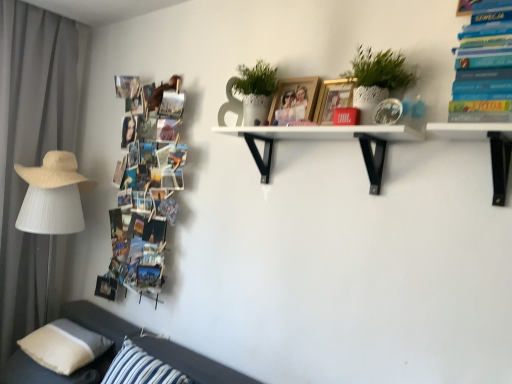
What do you see at coordinates (326, 139) in the screenshot? Image resolution: width=512 pixels, height=384 pixels. I see `white matte shelf at center` at bounding box center [326, 139].

The height and width of the screenshot is (384, 512). What are the coordinates of `wooden photo collage at left, the 1th book in the back-to-front sequence` in the screenshot? It's located at (145, 192).

Find the location of `white matte shelf at center`. white matte shelf at center is located at coordinates (326, 139).

Does white matte shelf at center have a lesser height compared to hardcover book at upper right, arranged as the 2th book when viewed from the left?

Correct, white matte shelf at center is not as tall as hardcover book at upper right, arranged as the 2th book when viewed from the left.

Which of these two, white matte shelf at center or hardcover book at upper right, the first book positioned from the right, is wider?

Wider between the two is white matte shelf at center.

From a real-world perspective, which is physically below, white matte shelf at center or hardcover book at upper right, the 1th book viewed from the front?

From a 3D spatial view, white matte shelf at center is below.

Would you consider white matte shelf at center to be distant from hardcover book at upper right, the first book positioned from the right?

No.

Identify the location of book that is the 1st object located in front of the gray fabric curtain at left. Image resolution: width=512 pixels, height=384 pixels. (145, 192).

Is gray fabric curtain at left located outside wooden photo collage at left, the 2th book in the right-to-left sequence?

Yes, gray fabric curtain at left is not within wooden photo collage at left, the 2th book in the right-to-left sequence.

Considering the relative sizes of gray fabric curtain at left and wooden photo collage at left, which is the second book from front to back, in the image provided, is gray fabric curtain at left shorter than wooden photo collage at left, which is the second book from front to back,?

In fact, gray fabric curtain at left may be taller than wooden photo collage at left, which is the second book from front to back.

Measure the distance between gray fabric curtain at left and wooden photo collage at left, which is the second book from front to back.

gray fabric curtain at left and wooden photo collage at left, which is the second book from front to back, are 27.02 inches apart from each other.

Consider the image. From a real-world perspective, who is located higher, white matte shelf at center or dark gray fabric couch at lower left?

white matte shelf at center, from a real-world perspective.

Looking at this image, is white matte shelf at center facing away from dark gray fabric couch at lower left?

white matte shelf at center is not turned away from dark gray fabric couch at lower left.

Is there a large distance between white matte shelf at center and dark gray fabric couch at lower left?

That's right, there is a large distance between white matte shelf at center and dark gray fabric couch at lower left.

Is metallic gold picture frame at upper center, the 1th picture frame when ordered from front to back, turned away from beige fabric pillow at lower left, which ranks as the 1th pillow in left-to-right order?

metallic gold picture frame at upper center, the 1th picture frame when ordered from front to back, does not have its back to beige fabric pillow at lower left, which ranks as the 1th pillow in left-to-right order.

Can you confirm if metallic gold picture frame at upper center, the 1th picture frame when ordered from front to back, is positioned to the right of beige fabric pillow at lower left, which ranks as the 1th pillow in left-to-right order?

Yes.

Who is shorter, metallic gold picture frame at upper center, placed as the second picture frame when sorted from back to front, or beige fabric pillow at lower left, which ranks as the 1th pillow in left-to-right order?

beige fabric pillow at lower left, which ranks as the 1th pillow in left-to-right order, is shorter.

Is point (352, 86) farther from camera compared to point (88, 355)?

No, (352, 86) is closer to viewer.

Consider the image. Between hardcover book at upper right, placed as the 2th book when sorted from back to front, and white textured pot at upper center, which one has more height?

With more height is hardcover book at upper right, placed as the 2th book when sorted from back to front.

Is hardcover book at upper right, placed as the 2th book when sorted from back to front, to the right of white textured pot at upper center from the viewer's perspective?

Yes, hardcover book at upper right, placed as the 2th book when sorted from back to front, is to the right of white textured pot at upper center.

Which of these two, hardcover book at upper right, placed as the 2th book when sorted from back to front, or white textured pot at upper center, is bigger?

With larger size is white textured pot at upper center.

Is beige fabric pillow at lower left, which is the 2th pillow from right to left, situated inside wooden photo collage at left, which is the first book from left to right, or outside?

beige fabric pillow at lower left, which is the 2th pillow from right to left, cannot be found inside wooden photo collage at left, which is the first book from left to right.

Which pillow is the 1st one when counting from the front of the wooden photo collage at left, the 2th book in the right-to-left sequence? Please provide its 2D coordinates.

[(64, 346)]

Can you confirm if beige fabric pillow at lower left, which ranks as the 1th pillow in left-to-right order, is bigger than wooden photo collage at left, the 2th book in the right-to-left sequence?

Incorrect, beige fabric pillow at lower left, which ranks as the 1th pillow in left-to-right order, is not larger than wooden photo collage at left, the 2th book in the right-to-left sequence.

Can you confirm if striped fabric pillow at lower left, which ranks as the first pillow in right-to-left order, is wider than metallic gold picture frame at upper center, placed as the second picture frame when sorted from back to front?

Indeed, striped fabric pillow at lower left, which ranks as the first pillow in right-to-left order, has a greater width compared to metallic gold picture frame at upper center, placed as the second picture frame when sorted from back to front.

Is point (161, 368) behind point (319, 115)?

Yes, point (161, 368) is farther from viewer.

Does striped fabric pillow at lower left, which ranks as the first pillow in right-to-left order, touch metallic gold picture frame at upper center, the 1th picture frame when ordered from front to back?

striped fabric pillow at lower left, which ranks as the first pillow in right-to-left order, is not next to metallic gold picture frame at upper center, the 1th picture frame when ordered from front to back, and they're not touching.

From the image's perspective, is striped fabric pillow at lower left, which ranks as the first pillow in right-to-left order, located above metallic gold picture frame at upper center, the 1th picture frame when ordered from front to back?

No.

The height and width of the screenshot is (384, 512). I want to click on book that is above the white matte shelf at center (from the image's perspective), so click(484, 66).

From a real-world perspective, count 1st books upward from the gray fabric curtain at left and point to it. Please provide its 2D coordinates.

[(145, 192)]

Which object lies nearer to the anchor point metallic gold picture frame at upper center, the 1th picture frame when ordered from front to back, gray fabric curtain at left or hardcover book at upper right, the 1th book viewed from the front?

Among the two, hardcover book at upper right, the 1th book viewed from the front, is located nearer to metallic gold picture frame at upper center, the 1th picture frame when ordered from front to back.

Based on their spatial positions, is wooden photo collage at left, the 1th book in the back-to-front sequence, or hardcover book at upper right, arranged as the 2th book when viewed from the left, further from striped fabric pillow at lower left, marked as the 2th pillow in a left-to-right arrangement?

hardcover book at upper right, arranged as the 2th book when viewed from the left, is positioned further to the anchor striped fabric pillow at lower left, marked as the 2th pillow in a left-to-right arrangement.

When comparing their distances from gray fabric curtain at left, does beige fabric pillow at lower left, which is the 2th pillow from right to left, or white textured pot at upper center seem closer?

The object closer to gray fabric curtain at left is beige fabric pillow at lower left, which is the 2th pillow from right to left.

Estimate the real-world distances between objects in this image. Which object is closer to gray fabric curtain at left, striped fabric pillow at lower left, marked as the 2th pillow in a left-to-right arrangement, or white matte shelf at center?

striped fabric pillow at lower left, marked as the 2th pillow in a left-to-right arrangement, is closer to gray fabric curtain at left.

Looking at the image, which one is located further to dark gray fabric couch at lower left, striped fabric pillow at lower left, marked as the 2th pillow in a left-to-right arrangement, or hardcover book at upper right, the first book positioned from the right?

Among the two, hardcover book at upper right, the first book positioned from the right, is located further to dark gray fabric couch at lower left.

Which object lies nearer to the anchor point wooden photo frame at upper center, acting as the second picture frame starting from the front, white textured pot at upper center or white matte shelf at center?

The object closer to wooden photo frame at upper center, acting as the second picture frame starting from the front, is white matte shelf at center.

Which object lies further to the anchor point beige fabric pillow at lower left, which is the 2th pillow from right to left, dark gray fabric couch at lower left or white textured pot at upper center?

The object further to beige fabric pillow at lower left, which is the 2th pillow from right to left, is white textured pot at upper center.

Looking at the image, which one is located further to metallic gold picture frame at upper center, the 1th picture frame when ordered from front to back, wooden photo frame at upper center, acting as the second picture frame starting from the front, or hardcover book at upper right, the first book positioned from the right?

Among the two, hardcover book at upper right, the first book positioned from the right, is located further to metallic gold picture frame at upper center, the 1th picture frame when ordered from front to back.

Find the location of `pillow situated between beige fabric pillow at lower left, which is the 2th pillow from right to left, and metallic gold picture frame at upper center, the 1th picture frame when ordered from front to back, from left to right`. pillow situated between beige fabric pillow at lower left, which is the 2th pillow from right to left, and metallic gold picture frame at upper center, the 1th picture frame when ordered from front to back, from left to right is located at coordinates (141, 368).

Find the location of a particular element. hat between wooden photo frame at upper center, acting as the second picture frame starting from the front, and striped fabric pillow at lower left, which ranks as the first pillow in right-to-left order, vertically is located at coordinates (52, 171).

This screenshot has width=512, height=384. I want to click on hat between gray fabric curtain at left and metallic gold picture frame at upper center, the 1th picture frame when ordered from front to back, from left to right, so click(x=52, y=171).

Image resolution: width=512 pixels, height=384 pixels. Find the location of `picture frame situated between beige straw hat at left and white matte shelf at center from left to right`. picture frame situated between beige straw hat at left and white matte shelf at center from left to right is located at coordinates (294, 100).